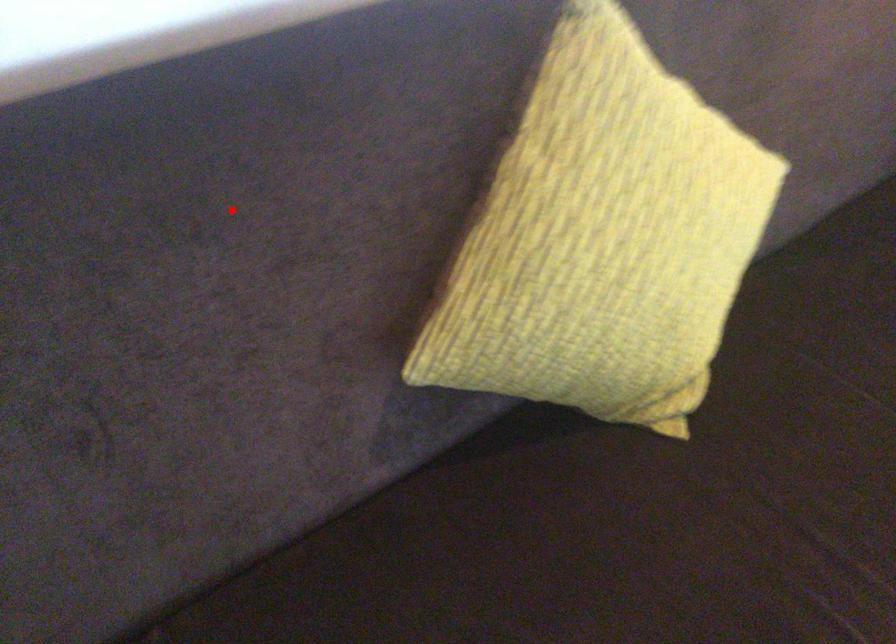
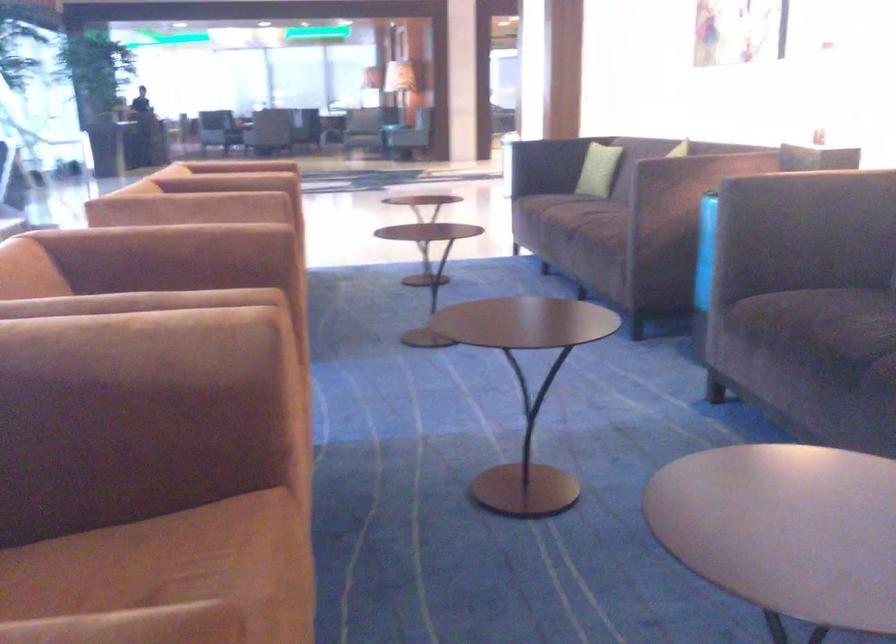
Question: I am providing you with two images of the same scene from different viewpoints. A red point is marked on the first image. Is the red point's position out of view in image 2?

Choices:
 (A) Yes
 (B) No

Answer: (A)